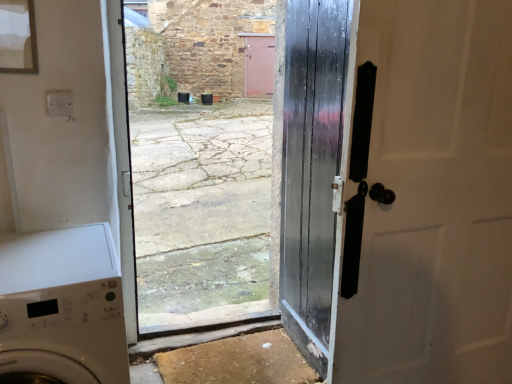
Describe the element at coordinates (399, 189) in the screenshot. I see `matte black door at right, the first door when ordered from right to left` at that location.

Measure the distance between point (332, 78) and camera.

Point (332, 78) and camera are 5.05 feet apart.

Image resolution: width=512 pixels, height=384 pixels. I want to click on matte black door at right, positioned as the second door in left-to-right order, so click(x=399, y=189).

Considering their positions, is white glossy washing machine at lower left located in front of or behind matte black door at right, positioned as the second door in left-to-right order?

In the image, white glossy washing machine at lower left appears in front of matte black door at right, positioned as the second door in left-to-right order.

Which point is more forward, [96,312] or [322,370]?

The point [96,312] is closer.

Is white glossy washing machine at lower left oriented towards matte black door at right, positioned as the second door in left-to-right order?

No, white glossy washing machine at lower left is not oriented towards matte black door at right, positioned as the second door in left-to-right order.

Is white glossy washing machine at lower left positioned beyond the bounds of matte black door at right, the first door when ordered from right to left?

Yes, white glossy washing machine at lower left is outside of matte black door at right, the first door when ordered from right to left.

Considering the relative sizes of glossy black door at center, placed as the 2th door when sorted from right to left, and matte black door at right, positioned as the second door in left-to-right order, in the image provided, is glossy black door at center, placed as the 2th door when sorted from right to left, bigger than matte black door at right, positioned as the second door in left-to-right order,?

Incorrect, glossy black door at center, placed as the 2th door when sorted from right to left, is not larger than matte black door at right, positioned as the second door in left-to-right order.

Is glossy black door at center, placed as the 2th door when sorted from right to left, in front of matte black door at right, the first door when ordered from right to left?

No, it is behind matte black door at right, the first door when ordered from right to left.

Which object is positioned more to the left, glossy black door at center, placed as the 2th door when sorted from right to left, or matte black door at right, the first door when ordered from right to left?

Positioned to the left is glossy black door at center, placed as the 2th door when sorted from right to left.

What's the angular difference between white glossy washing machine at lower left and glossy black door at center, placed as the 2th door when sorted from right to left,'s facing directions?

white glossy washing machine at lower left and glossy black door at center, placed as the 2th door when sorted from right to left, are facing 100 degrees away from each other.

Measure the distance between white glossy washing machine at lower left and glossy black door at center, the first door when ordered from left to right.

white glossy washing machine at lower left and glossy black door at center, the first door when ordered from left to right, are 35.60 inches apart.

Are white glossy washing machine at lower left and glossy black door at center, placed as the 2th door when sorted from right to left, located far from each other?

They are positioned close to each other.

Between white glossy washing machine at lower left and glossy black door at center, placed as the 2th door when sorted from right to left, which one has smaller size?

With smaller size is glossy black door at center, placed as the 2th door when sorted from right to left.

Between glossy black door at center, the first door when ordered from left to right, and white glossy washing machine at lower left, which one has larger width?

white glossy washing machine at lower left is wider.

From the image's perspective, is glossy black door at center, placed as the 2th door when sorted from right to left, on white glossy washing machine at lower left?

Indeed, from the image's perspective, glossy black door at center, placed as the 2th door when sorted from right to left, is shown above white glossy washing machine at lower left.

Looking at this image, does glossy black door at center, placed as the 2th door when sorted from right to left, turn towards white glossy washing machine at lower left?

Yes, glossy black door at center, placed as the 2th door when sorted from right to left, faces towards white glossy washing machine at lower left.

Between glossy black door at center, the first door when ordered from left to right, and white glossy washing machine at lower left, which one has smaller size?

glossy black door at center, the first door when ordered from left to right.

Considering the sizes of objects matte black door at right, the first door when ordered from right to left, and white glossy washing machine at lower left in the image provided, who is taller, matte black door at right, the first door when ordered from right to left, or white glossy washing machine at lower left?

matte black door at right, the first door when ordered from right to left.

Is matte black door at right, the first door when ordered from right to left, positioned far away from white glossy washing machine at lower left?

matte black door at right, the first door when ordered from right to left, is actually quite close to white glossy washing machine at lower left.

From the image's perspective, relative to white glossy washing machine at lower left, is matte black door at right, the first door when ordered from right to left, above or below?

From the image's perspective, matte black door at right, the first door when ordered from right to left, appears above white glossy washing machine at lower left.

Does matte black door at right, positioned as the second door in left-to-right order, turn towards white glossy washing machine at lower left?

No.

Considering the sizes of objects matte black door at right, positioned as the second door in left-to-right order, and glossy black door at center, the first door when ordered from left to right, in the image provided, who is taller, matte black door at right, positioned as the second door in left-to-right order, or glossy black door at center, the first door when ordered from left to right,?

Standing taller between the two is glossy black door at center, the first door when ordered from left to right.

Does point (420, 32) lie in front of point (301, 299)?

That is True.

Can you confirm if matte black door at right, positioned as the second door in left-to-right order, is positioned to the left of glossy black door at center, placed as the 2th door when sorted from right to left?

In fact, matte black door at right, positioned as the second door in left-to-right order, is to the right of glossy black door at center, placed as the 2th door when sorted from right to left.

From a real-world perspective, which door is the 2nd one above the white glossy washing machine at lower left? Please provide its 2D coordinates.

[(399, 189)]

Find the location of a particular element. This screenshot has height=384, width=512. door in front of the glossy black door at center, the first door when ordered from left to right is located at coordinates (399, 189).

From the image, which object appears to be farther from glossy black door at center, the first door when ordered from left to right, white glossy washing machine at lower left or matte black door at right, positioned as the second door in left-to-right order?

white glossy washing machine at lower left is further to glossy black door at center, the first door when ordered from left to right.

Estimate the real-world distances between objects in this image. Which object is closer to matte black door at right, positioned as the second door in left-to-right order, glossy black door at center, the first door when ordered from left to right, or white glossy washing machine at lower left?

Based on the image, glossy black door at center, the first door when ordered from left to right, appears to be nearer to matte black door at right, positioned as the second door in left-to-right order.

Estimate the real-world distances between objects in this image. Which object is further from glossy black door at center, placed as the 2th door when sorted from right to left, matte black door at right, the first door when ordered from right to left, or white glossy washing machine at lower left?

white glossy washing machine at lower left is further to glossy black door at center, placed as the 2th door when sorted from right to left.

Based on their spatial positions, is matte black door at right, positioned as the second door in left-to-right order, or glossy black door at center, placed as the 2th door when sorted from right to left, closer to white glossy washing machine at lower left?

Among the two, glossy black door at center, placed as the 2th door when sorted from right to left, is located nearer to white glossy washing machine at lower left.

Estimate the real-world distances between objects in this image. Which object is further from matte black door at right, the first door when ordered from right to left, white glossy washing machine at lower left or glossy black door at center, placed as the 2th door when sorted from right to left?

white glossy washing machine at lower left is positioned further to the anchor matte black door at right, the first door when ordered from right to left.

Considering their positions, is glossy black door at center, placed as the 2th door when sorted from right to left, positioned closer to white glossy washing machine at lower left than matte black door at right, the first door when ordered from right to left?

glossy black door at center, placed as the 2th door when sorted from right to left, is closer to white glossy washing machine at lower left.

Locate an element on the screen. The width and height of the screenshot is (512, 384). door between white glossy washing machine at lower left and matte black door at right, the first door when ordered from right to left, in the horizontal direction is located at coordinates (312, 169).